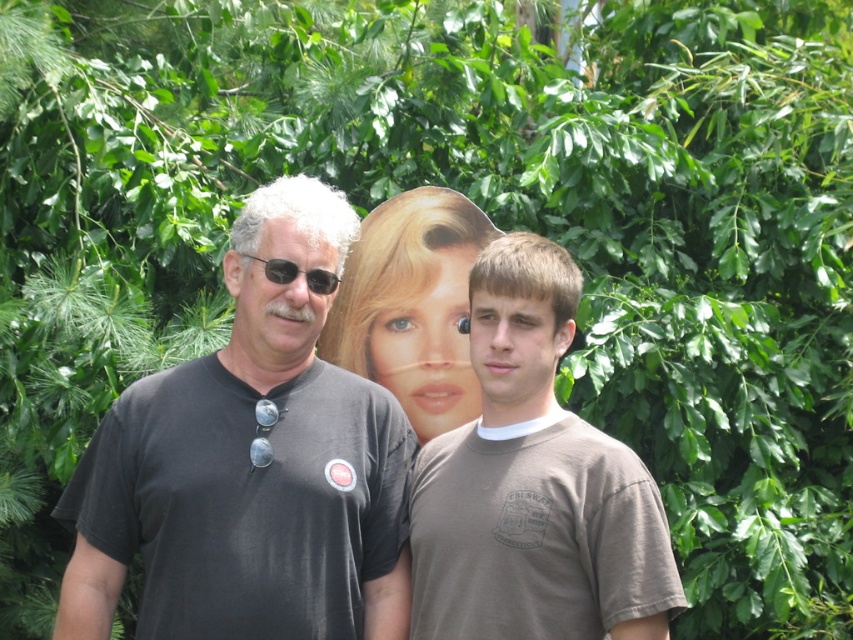
Question: Is brown cotton t-shirt at center closer to the viewer compared to black plastic sunglasses at left?

Choices:
 (A) yes
 (B) no

Answer: (A)

Question: Is smooth plastic poster at center below black plastic sunglasses at left?

Choices:
 (A) yes
 (B) no

Answer: (A)

Question: Is brown cotton t-shirt at center thinner than black plastic sunglasses at left?

Choices:
 (A) yes
 (B) no

Answer: (B)

Question: Which object is positioned farthest from the black plastic sunglasses at left?

Choices:
 (A) black matte t-shirt at left
 (B) smooth plastic poster at center
 (C) brown cotton t-shirt at center

Answer: (C)

Question: Estimate the real-world distances between objects in this image. Which object is farther from the black plastic sunglasses at left?

Choices:
 (A) brown cotton t-shirt at center
 (B) black matte t-shirt at left
 (C) smooth plastic poster at center

Answer: (A)

Question: Which point is closer to the camera?

Choices:
 (A) black matte t-shirt at left
 (B) black plastic sunglasses at left
 (C) smooth plastic poster at center

Answer: (A)